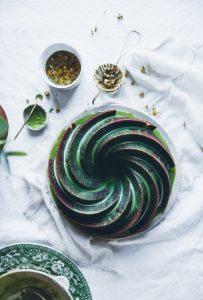
The image size is (203, 300). What are the coordinates of `tiny spoon` in the screenshot? It's located at (39, 99).